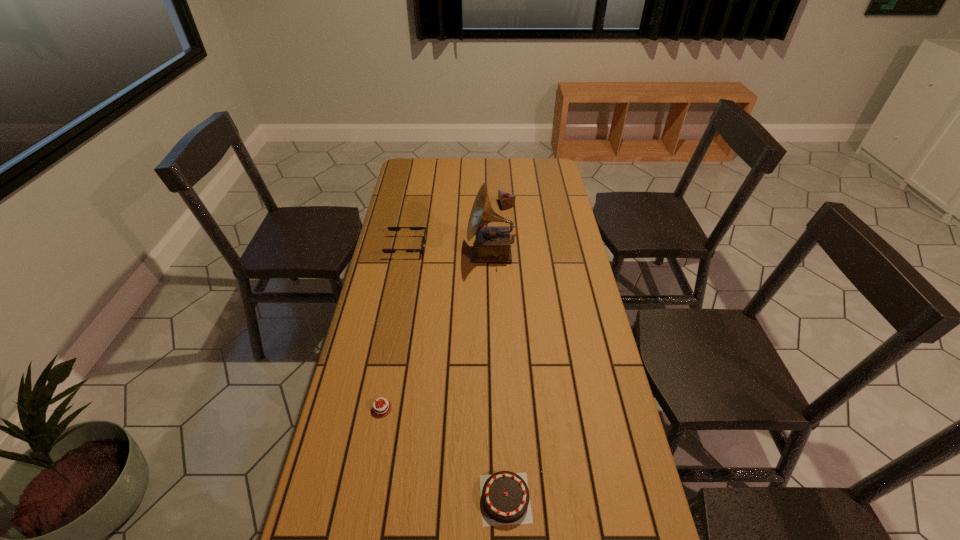
In order to click on vacant space that satisfies the following two spatial constraints: 1. on the temples of the sunglasses; 2. on the right side of the nearest object in this screenshot , I will do `click(358, 498)`.

This screenshot has height=540, width=960. What are the coordinates of `free space that satisfies the following two spatial constraints: 1. on the temples of the sunglasses; 2. on the back side of the second tallest chocolate cake` in the screenshot? It's located at (358, 498).